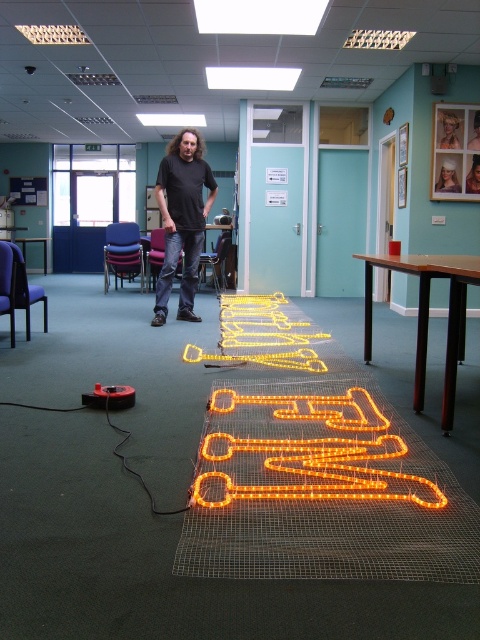
Question: Can you confirm if orange wire neon sign at center is positioned to the right of orange led lights at center?

Choices:
 (A) no
 (B) yes

Answer: (B)

Question: Can you confirm if orange wire neon sign at center is wider than orange led lights at center?

Choices:
 (A) yes
 (B) no

Answer: (B)

Question: Is orange wire neon sign at center to the left of orange led lights at center from the viewer's perspective?

Choices:
 (A) no
 (B) yes

Answer: (A)

Question: Which point is farther to the camera?

Choices:
 (A) (356, 452)
 (B) (227, 346)
 (C) (170, 200)

Answer: (C)

Question: Which point appears farthest from the camera in this image?

Choices:
 (A) (192, 136)
 (B) (288, 484)

Answer: (A)

Question: Estimate the real-world distances between objects in this image. Which object is closer to the orange wire neon sign at center?

Choices:
 (A) black matte shirt at center
 (B) orange led lights at center

Answer: (B)